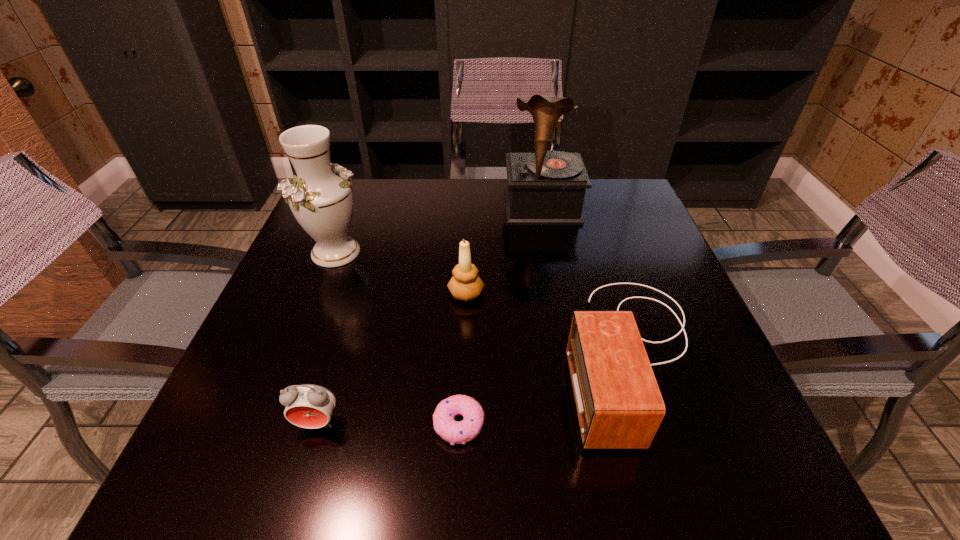
The image size is (960, 540). In order to click on vacant region at the far edge of the desktop in this screenshot , I will do `click(583, 219)`.

Find the location of a particular element. The height and width of the screenshot is (540, 960). blank space at the near edge of the desktop is located at coordinates (319, 476).

You are a GUI agent. You are given a task and a screenshot of the screen. Output one action in this format:
    pyautogui.click(x=<x>, y=<y>)
    Task: Click on the vacant space at the right edge of the desktop
    
    Given the screenshot: What is the action you would take?
    pyautogui.click(x=639, y=232)

This screenshot has height=540, width=960. What are the coordinates of `free space at the far left corner of the desktop` in the screenshot? It's located at (358, 197).

You are a GUI agent. You are given a task and a screenshot of the screen. Output one action in this format:
    pyautogui.click(x=<x>, y=<y>)
    Task: Click on the vacant space at the far right corner of the desktop
    
    Given the screenshot: What is the action you would take?
    pyautogui.click(x=614, y=182)

The image size is (960, 540). What are the coordinates of `free space at the near right corner` in the screenshot? It's located at (730, 473).

Identify the location of empty location between the alarm clock and the farthest object. (430, 315).

At what (x,y) coordinates should I click in order to perform the action: click on free space between the candle_holder and the phonograph_record. Please return your answer as a coordinate pair (x, y). The image size is (960, 540). Looking at the image, I should click on (504, 251).

The image size is (960, 540). I want to click on unoccupied area between the candle_holder and the vase, so 400,273.

Find the location of a particular element. This screenshot has height=540, width=960. vacant space that's between the alarm clock and the radio receiver is located at coordinates (475, 388).